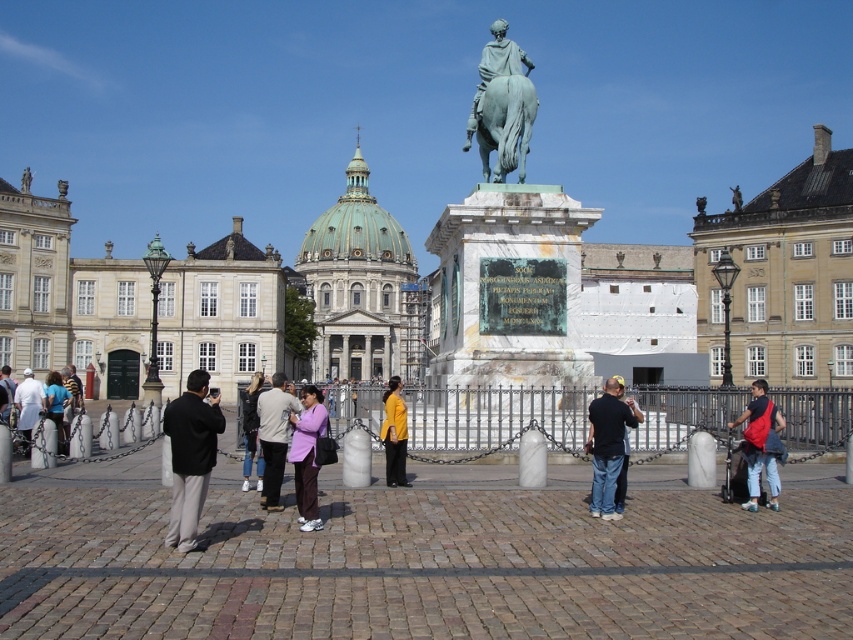
You are an artist sketching the scene of the equestrian statue in the public square. You notice two pieces of clothing worn by a person at the center of the image. The clothing items are the purple fabric pants at center and the light purple fabric shirt at center. Which clothing item is positioned higher on the person?

The purple fabric pants at center is located above the light purple fabric shirt at center, so the purple fabric pants at center is positioned higher on the person.

You are a photographer trying to capture the polished bronze statue at center and the yellow matte shirt at center in the same frame. Based on their sizes, which object should you focus on first to ensure both are clearly visible in your photo?

The polished bronze statue at center is bigger than the yellow matte shirt at center, so you should focus on the polished bronze statue at center first to ensure both are clearly visible in your photo.

You are a photographer standing in the public square and want to capture both the polished bronze statue at center and the yellow matte shirt at center in a single frame. Based on their sizes, which object will appear larger in the photo?

The polished bronze statue at center will appear larger in the photo because it is taller than the yellow matte shirt at center.